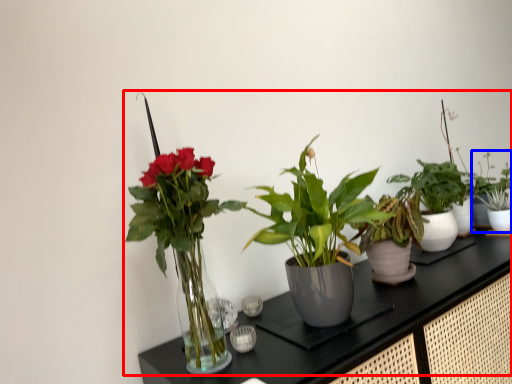
Question: Among these objects, which one is farthest to the camera, houseplant (highlighted by a red box) or houseplant (highlighted by a blue box)?

Choices:
 (A) houseplant
 (B) houseplant

Answer: (B)